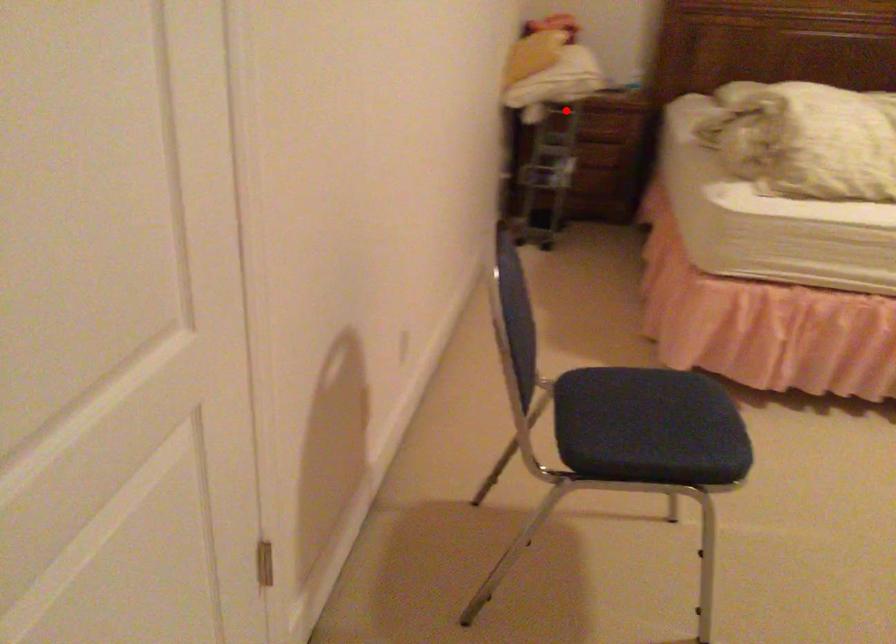
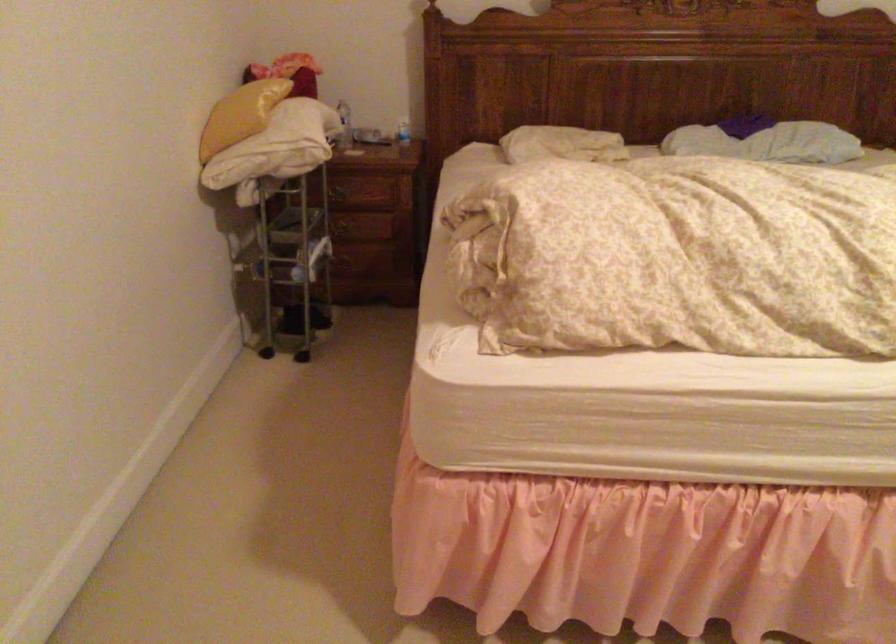
The point at the highlighted location is marked in the first image. Where is the corresponding point in the second image?

(338, 194)